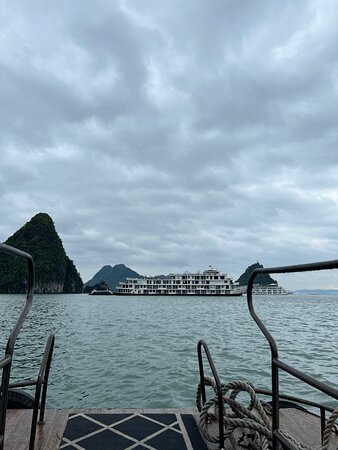
I want to click on floor mat, so [x=139, y=434].